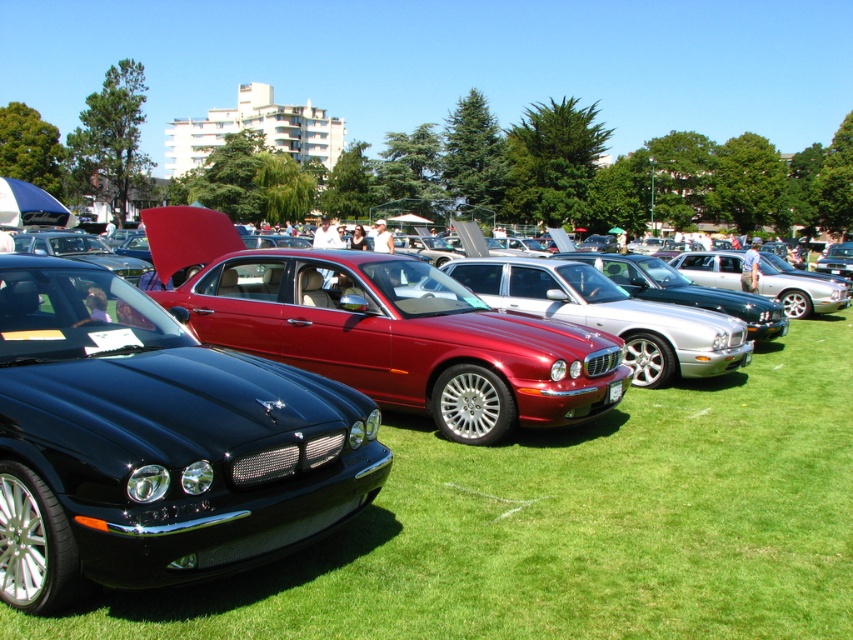
Question: Which point appears closest to the camera in this image?

Choices:
 (A) (94, 321)
 (B) (238, 364)

Answer: (B)

Question: Where is shiny black sedan at center located in relation to glossy metallic car at center in the image?

Choices:
 (A) above
 (B) below

Answer: (A)

Question: Which point is closer to the camera?

Choices:
 (A) (143, 561)
 (B) (222, 368)

Answer: (A)

Question: Which point appears farthest from the camera in this image?

Choices:
 (A) (260, 486)
 (B) (183, 452)

Answer: (A)

Question: Is shiny black sedan at center to the right of glossy metallic car at center from the viewer's perspective?

Choices:
 (A) yes
 (B) no

Answer: (B)

Question: Is shiny black sedan at center closer to the viewer compared to glossy metallic car at center?

Choices:
 (A) yes
 (B) no

Answer: (A)